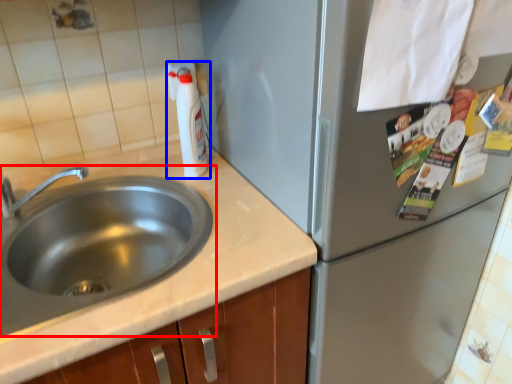
Question: Which object appears closest to the camera in this image, sink (highlighted by a red box) or bottle (highlighted by a blue box)?

Choices:
 (A) sink
 (B) bottle

Answer: (A)